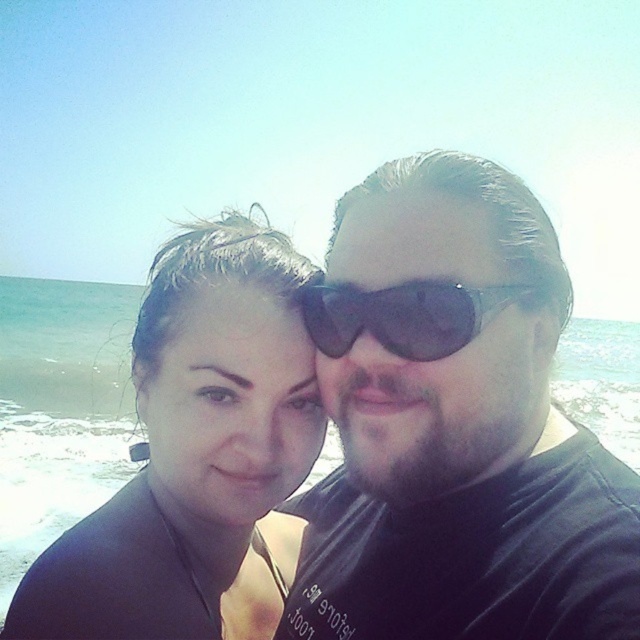
You are a photographer trying to capture a closeup of the matte black wetsuit at center. You have a zoom lens that can focus on a specific point. The coordinates given are in the format of normalized coordinates between 0 and 1. The point at [196,456] is on the matte black wetsuit at center. Where should you aim your camera to focus on the matte black wetsuit at center?

The point at [196,456] is on the matte black wetsuit at center, so you should aim your camera at that coordinate to focus on the matte black wetsuit at center.

You are trying to locate the matte black wetsuit at center and the black plastic sunglasses at center in the beach selfie. Which object is positioned more to the left?

The matte black wetsuit at center is positioned to the left of the black plastic sunglasses at center.